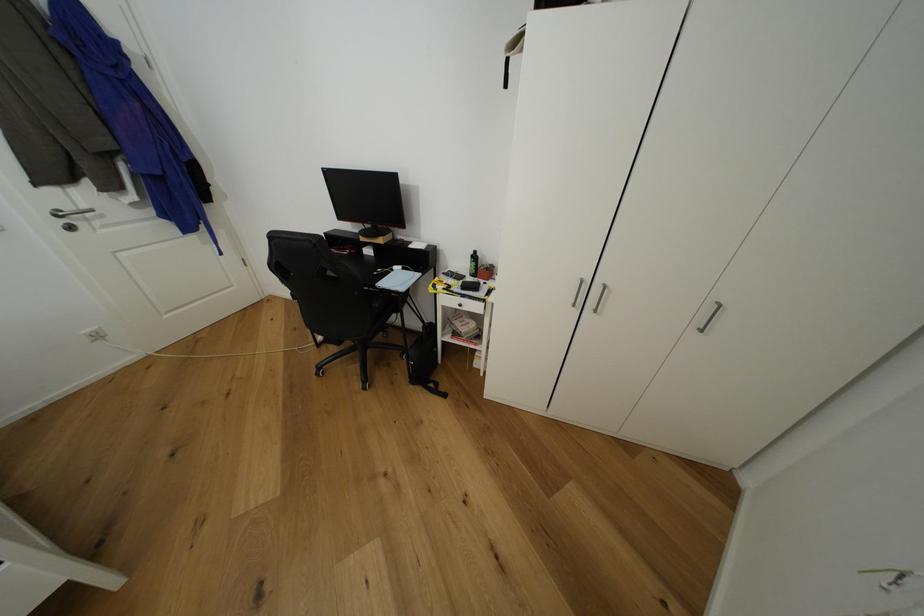
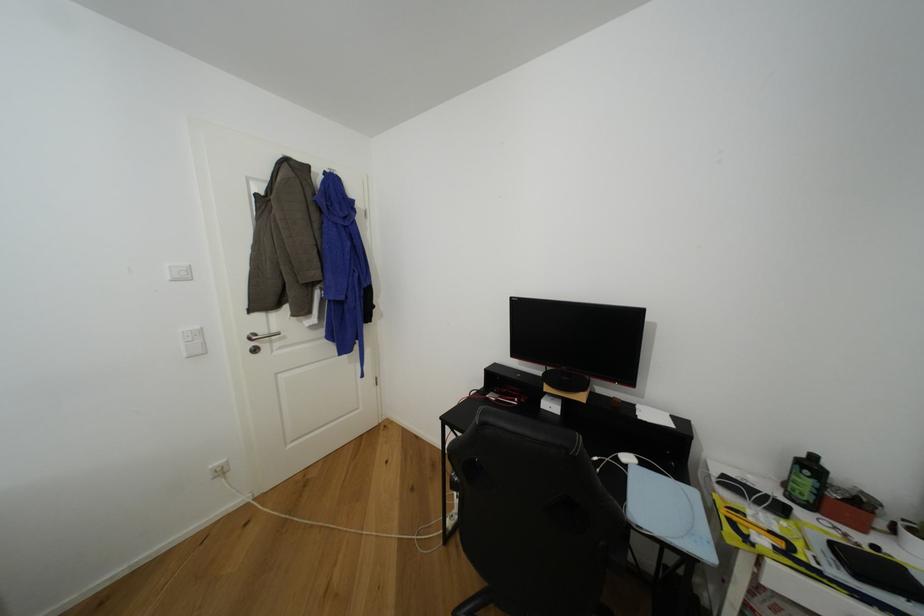
The point at (403, 270) is marked in the first image. Where is the corresponding point in the second image?

(633, 460)